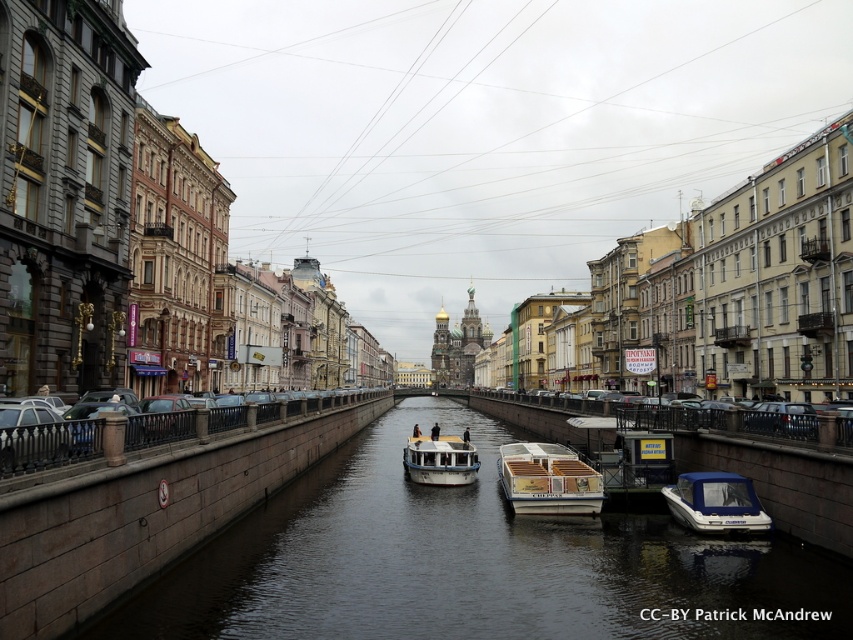
Question: Which point appears farthest from the camera in this image?

Choices:
 (A) (556, 525)
 (B) (567, 456)

Answer: (B)

Question: Does matte black car at left have a larger size compared to wooden deck boat at center?

Choices:
 (A) no
 (B) yes

Answer: (B)

Question: Which of the following is the closest to the observer?

Choices:
 (A) matte black car at left
 (B) brown stone canal at center
 (C) white plastic boat at lower right

Answer: (A)

Question: Does wooden deck boat at center come behind white plastic boat at lower right?

Choices:
 (A) no
 (B) yes

Answer: (B)

Question: Is white plastic boat at lower right positioned behind white matte boat at center?

Choices:
 (A) no
 (B) yes

Answer: (A)

Question: Which point is farther to the camera?

Choices:
 (A) brown stone canal at center
 (B) white matte boat at center

Answer: (B)